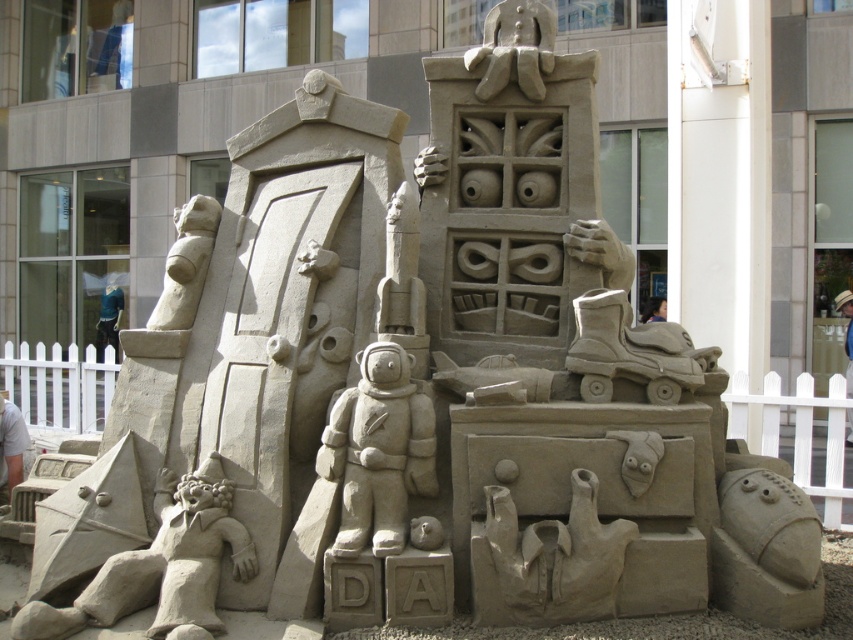
You are an artist trying to place a new sculpture in front of the sand sculpture. You have two items to place there. The smooth beige statue at upper left and the blue fabric shirt at center. Which item should you place closer to the ground to maintain balance?

The smooth beige statue at upper left is shorter than the blue fabric shirt at center. To maintain balance, place the shorter smooth beige statue at upper left closer to the ground.

You are a visitor standing at the entrance of the sand sculpture and want to take a photo of both the smooth beige astronaut at center and the smooth sand rocket at lower right. How far apart are these two objects from each other?

The smooth beige astronaut at center is 1.59 meters from the smooth sand rocket at lower right, so they are 1.59 meters apart.

You are standing at the base of the sand sculpture and want to take a photo of the smooth beige astronaut at center using a camera. The camera requires a minimum distance of 15 feet to focus properly. Will you be able to take a clear photo from your current position?

The smooth beige astronaut at center and the camera are 16.15 feet apart, which is more than the required 15 feet. Therefore, you can take a clear photo from your current position.